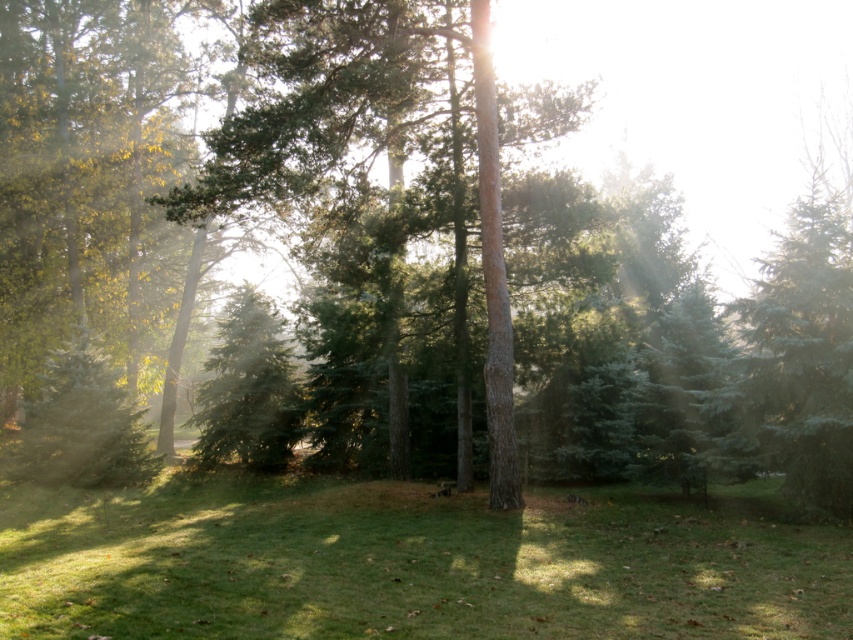
Does point (151, 531) lie behind point (231, 374)?

That is False.

Between point (630, 531) and point (251, 340), which one is positioned behind?

Positioned behind is point (251, 340).

Who is more forward, [796,561] or [262,339]?

Positioned in front is point [796,561].

The image size is (853, 640). I want to click on green grass at center, so click(x=416, y=564).